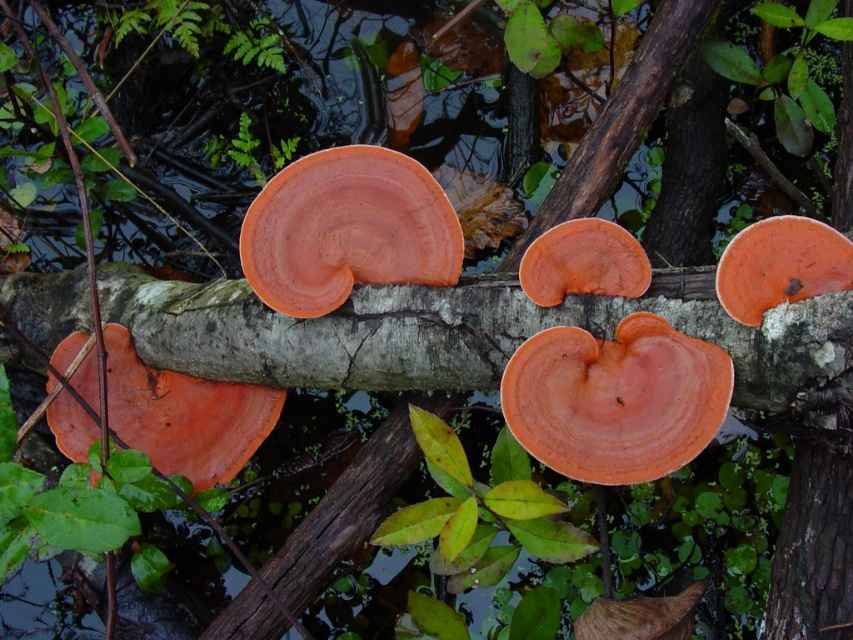
Which of these two, orange matte fungus at center or smooth bark tree trunk at right, stands taller?

With more height is smooth bark tree trunk at right.

Which is more to the right, orange matte fungus at center or smooth bark tree trunk at right?

From the viewer's perspective, smooth bark tree trunk at right appears more on the right side.

Describe the element at coordinates (347, 228) in the screenshot. The width and height of the screenshot is (853, 640). I see `orange matte fungus at center` at that location.

Locate an element on the screen. orange matte fungus at center is located at coordinates (347, 228).